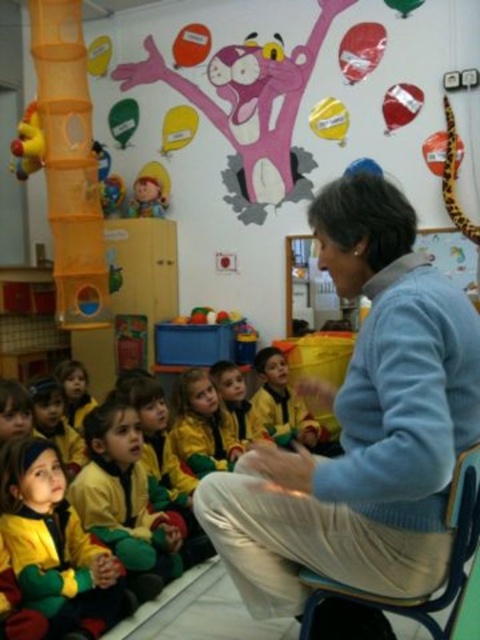
Question: Where is yellow-green fabric jacket at lower left located in relation to yellow-green uniform at center in the image?

Choices:
 (A) above
 (B) below

Answer: (B)

Question: Does yellow-green jersey at center have a greater width compared to yellow-green uniform at center?

Choices:
 (A) no
 (B) yes

Answer: (B)

Question: Estimate the real-world distances between objects in this image. Which object is closer to the yellow-green jersey at center?

Choices:
 (A) yellow rubber duck at left
 (B) yellow/yellow-green fabric at center
 (C) blue fleece jacket at center

Answer: (C)

Question: Among these points, which one is farthest from the camera?

Choices:
 (A) (239, 445)
 (B) (327, 492)

Answer: (A)

Question: Is yellow-green jersey at center bigger than yellow/yellow-green fabric at center?

Choices:
 (A) no
 (B) yes

Answer: (B)

Question: Among these objects, which one is nearest to the camera?

Choices:
 (A) yellow/yellow-green fabric at center
 (B) yellow rubber duck at left

Answer: (A)